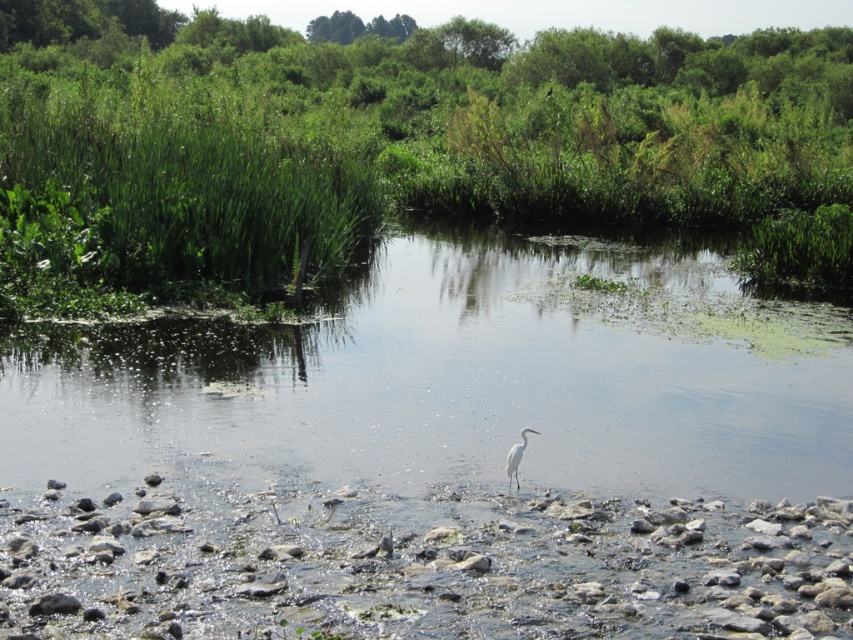
Does green grass at center have a greater width compared to white matte bird at center?

Correct, the width of green grass at center exceeds that of white matte bird at center.

The height and width of the screenshot is (640, 853). What do you see at coordinates (395, 131) in the screenshot? I see `green grass at center` at bounding box center [395, 131].

At what (x,y) coordinates should I click in order to perform the action: click on green grass at center. Please return your answer as a coordinate pair (x, y). Image resolution: width=853 pixels, height=640 pixels. Looking at the image, I should click on (395, 131).